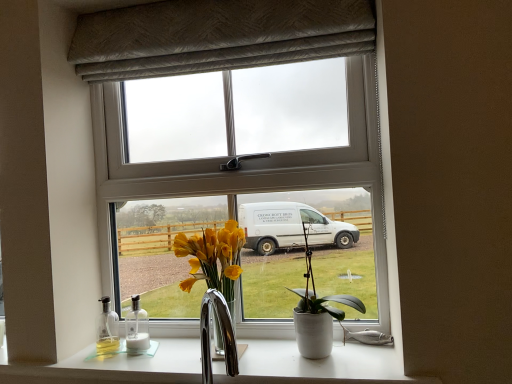
Describe the element at coordinates (317, 313) in the screenshot. Image resolution: width=512 pixels, height=384 pixels. I see `white ceramic pot at center` at that location.

What do you see at coordinates (216, 36) in the screenshot? The width and height of the screenshot is (512, 384). I see `textured gray curtain at upper center` at bounding box center [216, 36].

At what (x,y) coordinates should I click in order to perform the action: click on white ceramic pot at center. Please return your answer as a coordinate pair (x, y). Image resolution: width=512 pixels, height=384 pixels. Looking at the image, I should click on (317, 313).

In terms of size, does white ceramic pot at center appear bigger or smaller than white plastic window at center?

white ceramic pot at center is smaller than white plastic window at center.

How distant is white ceramic pot at center from white plastic window at center?

12.16 inches.

Which is behind, white ceramic pot at center or white plastic window at center?

white plastic window at center is further from the camera.

How many degrees apart are the facing directions of white ceramic pot at center and white plastic window at center?

The angular difference between white ceramic pot at center and white plastic window at center is 2.32 degrees.

From the picture: Is white glossy bottle at lower left touching white ceramic pot at center?

No, white glossy bottle at lower left is not beside white ceramic pot at center.

Is white glossy bottle at lower left taller or shorter than white ceramic pot at center?

Considering their sizes, white glossy bottle at lower left has less height than white ceramic pot at center.

From a real-world perspective, is white glossy bottle at lower left physically above white ceramic pot at center?

No, from a real-world perspective, white glossy bottle at lower left is not over white ceramic pot at center

Consider the image. Is white glossy bottle at lower left not within white glossy countertop at lower center?

Indeed, white glossy bottle at lower left is completely outside white glossy countertop at lower center.

From the image's perspective, is white glossy bottle at lower left located above white glossy countertop at lower center?

Yes, from the image's perspective, white glossy bottle at lower left is on top of white glossy countertop at lower center.

Measure the distance between white glossy bottle at lower left and white glossy countertop at lower center.

The distance of white glossy bottle at lower left from white glossy countertop at lower center is 10.17 inches.

From a real-world perspective, is white glossy bottle at lower left physically located above or below white glossy countertop at lower center?

In terms of real-world spatial position, white glossy bottle at lower left is above white glossy countertop at lower center.

Is textured gray curtain at upper center not close to white glossy countertop at lower center?

textured gray curtain at upper center is near white glossy countertop at lower center, not far away.

Considering the relative positions of textured gray curtain at upper center and white glossy countertop at lower center in the image provided, is textured gray curtain at upper center to the left or to the right of white glossy countertop at lower center?

textured gray curtain at upper center is positioned on white glossy countertop at lower center's left side.

From the image's perspective, is textured gray curtain at upper center over white glossy countertop at lower center?

Yes.

Would you say textured gray curtain at upper center is outside white glossy countertop at lower center?

Indeed, textured gray curtain at upper center is completely outside white glossy countertop at lower center.

Is white plastic window at center turned away from white ceramic pot at center?

Yes, white plastic window at center is facing away from white ceramic pot at center.

Does white plastic window at center appear on the left side of white ceramic pot at center?

Yes.

From the image's perspective, between white plastic window at center and white ceramic pot at center, who is located below?

white ceramic pot at center is shown below in the image.

Can you tell me how much white plastic window at center and white glossy bottle at lower left differ in facing direction?

5.08 degrees.

How far apart are white plastic window at center and white glossy bottle at lower left?

The distance of white plastic window at center from white glossy bottle at lower left is 17.79 inches.

Could you tell me if white plastic window at center is turned towards white glossy bottle at lower left?

Yes.

Is white plastic window at center not inside white glossy bottle at lower left?

white plastic window at center is positioned outside white glossy bottle at lower left.

Would you say white glossy countertop at lower center is a long distance from white glossy bottle at lower left?

They are positioned close to each other.

Is white glossy countertop at lower center positioned with its back to white glossy bottle at lower left?

No, white glossy countertop at lower center's orientation is not away from white glossy bottle at lower left.

Consider the image. Considering their positions, is white glossy countertop at lower center located in front of or behind white glossy bottle at lower left?

Visually, white glossy countertop at lower center is located in front of white glossy bottle at lower left.

The width and height of the screenshot is (512, 384). I want to click on window that appears above the white ceramic pot at center (from a real-world perspective), so click(x=247, y=167).

Find the location of a particular element. bottle below the white ceramic pot at center (from the image's perspective) is located at coordinates (137, 328).

Which object lies nearer to the anchor point white ceramic pot at center, textured gray curtain at upper center or white plastic window at center?

Based on the image, white plastic window at center appears to be nearer to white ceramic pot at center.

Which object lies further to the anchor point white ceramic pot at center, white glossy bottle at lower left or white plastic window at center?

Among the two, white glossy bottle at lower left is located further to white ceramic pot at center.

From the image, which object appears to be farther from white ceramic pot at center, white plastic window at center or white glossy countertop at lower center?

white plastic window at center.

Looking at the image, which one is located closer to textured gray curtain at upper center, white ceramic pot at center or white glossy bottle at lower left?

Based on the image, white ceramic pot at center appears to be nearer to textured gray curtain at upper center.

From the image, which object appears to be farther from white glossy countertop at lower center, white plastic window at center or textured gray curtain at upper center?

Based on the image, textured gray curtain at upper center appears to be further to white glossy countertop at lower center.

Based on the photo, looking at the image, which one is located further to textured gray curtain at upper center, white glossy countertop at lower center or white plastic window at center?

white glossy countertop at lower center is further to textured gray curtain at upper center.

Estimate the real-world distances between objects in this image. Which object is further from white glossy bottle at lower left, white ceramic pot at center or textured gray curtain at upper center?

Based on the image, textured gray curtain at upper center appears to be further to white glossy bottle at lower left.

Considering their positions, is white plastic window at center positioned closer to white glossy bottle at lower left than white glossy countertop at lower center?

Based on the image, white glossy countertop at lower center appears to be nearer to white glossy bottle at lower left.

This screenshot has height=384, width=512. Identify the location of houseplant between textured gray curtain at upper center and white glossy countertop at lower center in the up-down direction. (317, 313).

Locate an element on the screen. The height and width of the screenshot is (384, 512). bottle between white plastic window at center and white glossy countertop at lower center in the vertical direction is located at coordinates point(137,328).

The height and width of the screenshot is (384, 512). In order to click on window between textured gray curtain at upper center and white glossy bottle at lower left vertically in this screenshot , I will do `click(247, 167)`.

Identify the location of window between textured gray curtain at upper center and white glossy countertop at lower center from top to bottom. (247, 167).